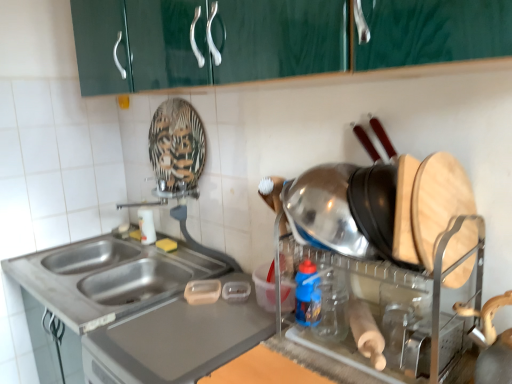
Question: Considering the positions of white glossy bottle at sink, which is counted as the 2th bottle, starting from the right, and stainless steel sink at lower left in the image, is white glossy bottle at sink, which is counted as the 2th bottle, starting from the right, taller or shorter than stainless steel sink at lower left?

Choices:
 (A) short
 (B) tall

Answer: (B)

Question: Looking at their shapes, would you say white glossy bottle at sink, which appears as the first bottle when viewed from the back, is wider or thinner than stainless steel sink at lower left?

Choices:
 (A) thin
 (B) wide

Answer: (A)

Question: Estimate the real-world distances between objects in this image. Which object is closer to the shiny metallic pot at right?

Choices:
 (A) stainless steel sink at lower left
 (B) blue plastic bottle at center, positioned as the 2th bottle in back-to-front order
 (C) white glossy bottle at sink, acting as the 1th bottle starting from the left

Answer: (B)

Question: Which object is positioned closest to the white glossy bottle at sink, acting as the 1th bottle starting from the left?

Choices:
 (A) blue plastic bottle at center, the second bottle in the left-to-right sequence
 (B) stainless steel sink at lower left
 (C) shiny metallic pot at right

Answer: (B)